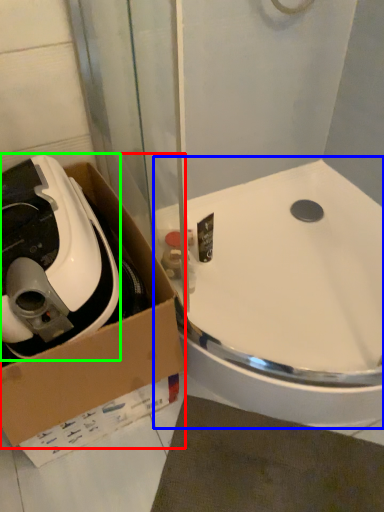
Question: Considering the real-world distances, which object is farthest from box (highlighted by a red box)? sink (highlighted by a blue box) or appliance (highlighted by a green box)?

Choices:
 (A) sink
 (B) appliance

Answer: (A)